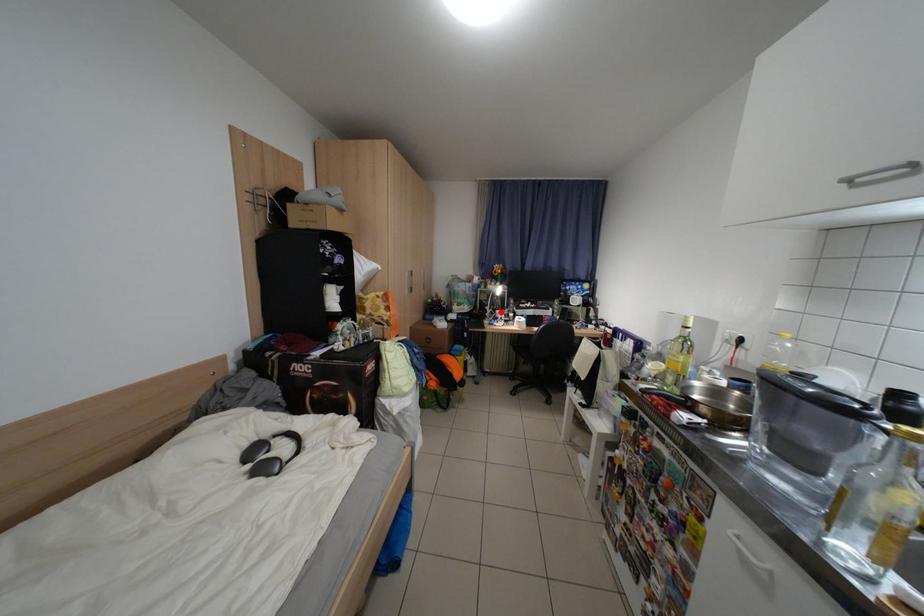
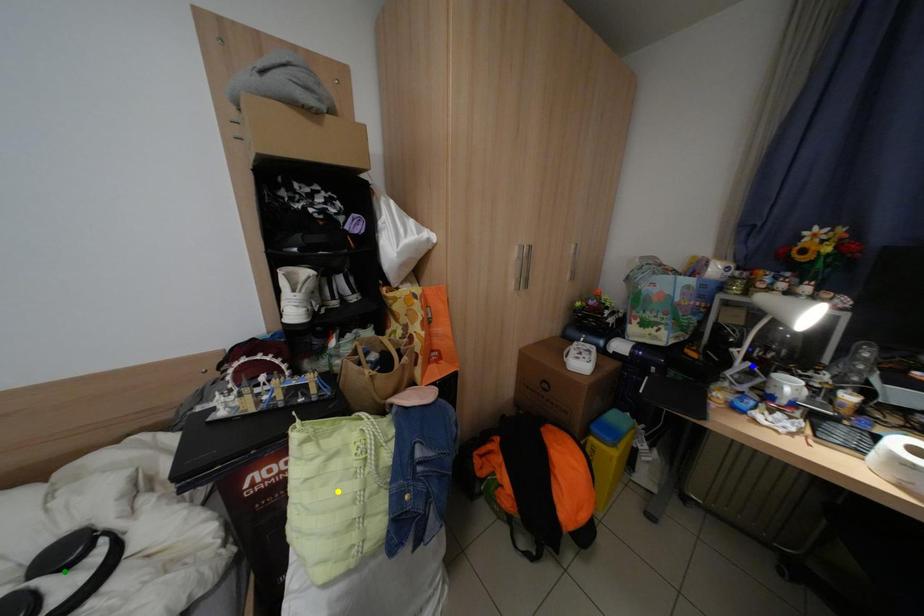
Question: I am providing you with two images of the same scene from different viewpoints. A red point is marked on the first image. You are given multiple points on the second image. Which spot in image 2 lines up with the point in image 1?

Choices:
 (A) yellow point
 (B) green point
 (C) blue point

Answer: (C)